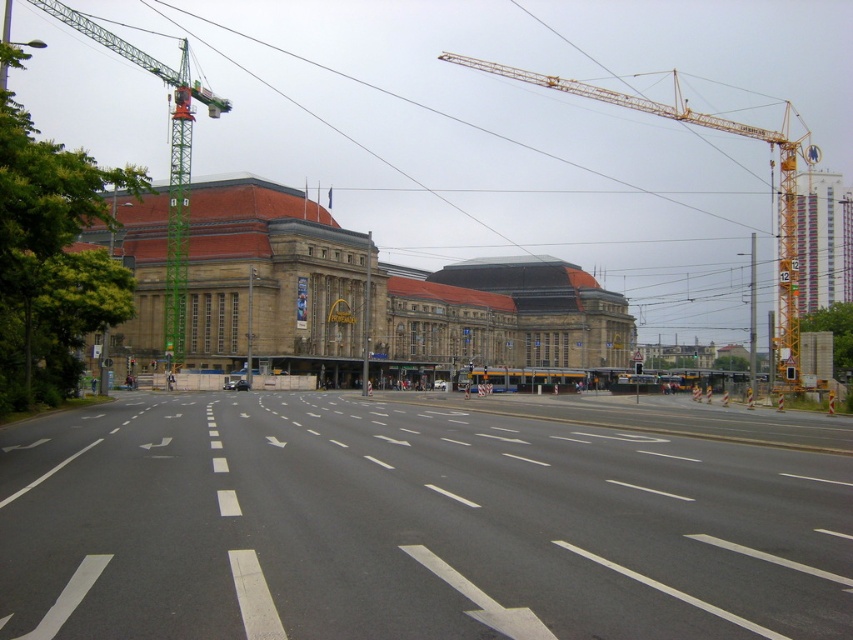
Locate an element on the screen. asphalt road at center is located at coordinates (408, 528).

Does asphalt road at center appear on the right side of brown stone building at center?

In fact, asphalt road at center is to the left of brown stone building at center.

This screenshot has height=640, width=853. What do you see at coordinates (408, 528) in the screenshot? I see `asphalt road at center` at bounding box center [408, 528].

You are a GUI agent. You are given a task and a screenshot of the screen. Output one action in this format:
    pyautogui.click(x=<x>, y=<y>)
    Task: Click on the asphalt road at center
    The height and width of the screenshot is (640, 853).
    Given the screenshot: What is the action you would take?
    pyautogui.click(x=408, y=528)

Does asphalt road at center have a lesser width compared to green metal crane at left?

Correct, asphalt road at center's width is less than green metal crane at left's.

Measure the distance from asphalt road at center to green metal crane at left.

asphalt road at center is 114.66 meters away from green metal crane at left.

Which is in front, point (805, 516) or point (184, 170)?

Point (805, 516)

Where is `asphalt road at center`? This screenshot has width=853, height=640. asphalt road at center is located at coordinates click(408, 528).

Consider the image. Is yellow plastic traffic light at center positioned in front of red glass traffic light at center?

That is True.

Identify the location of yellow plastic traffic light at center. (790, 372).

Identify the location of yellow plastic traffic light at center. This screenshot has height=640, width=853. (790, 372).